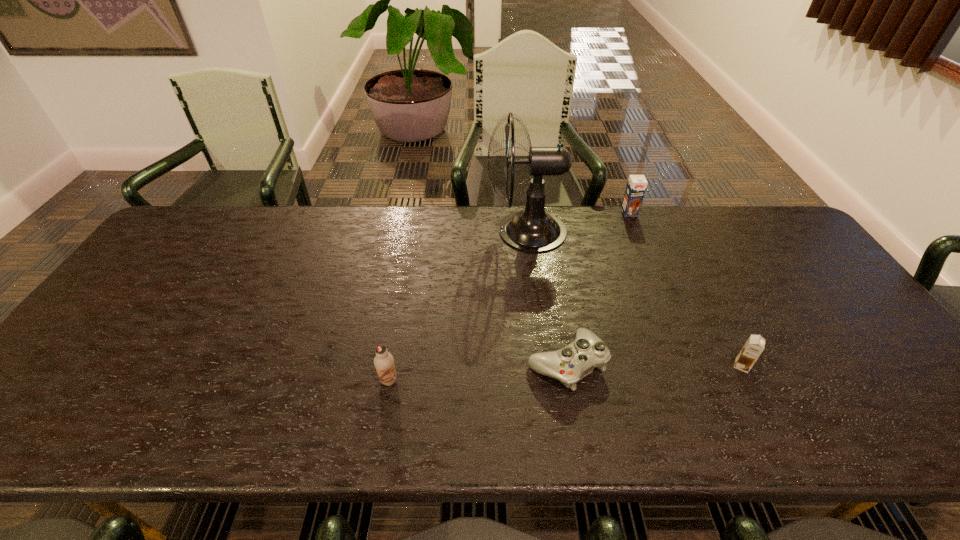
The width and height of the screenshot is (960, 540). What are the coordinates of `the tallest object` in the screenshot? It's located at (533, 230).

Locate an element on the screen. The image size is (960, 540). the fourth object from left to right is located at coordinates (636, 186).

At what (x,y) coordinates should I click in order to perform the action: click on the farthest chocolate milk. Please return your answer as a coordinate pair (x, y). Looking at the image, I should click on (636, 186).

Locate an element on the screen. the leftmost object is located at coordinates [x=384, y=362].

Image resolution: width=960 pixels, height=540 pixels. Find the location of `the second shortest chocolate milk`. the second shortest chocolate milk is located at coordinates (384, 362).

The width and height of the screenshot is (960, 540). Identify the location of the rightmost object. (754, 346).

I want to click on the shortest chocolate milk, so click(754, 346).

Identify the location of the shortest object. The height and width of the screenshot is (540, 960). (570, 364).

You are a GUI agent. You are given a task and a screenshot of the screen. Output one action in this format:
    pyautogui.click(x=<x>, y=<y>)
    Task: Click on the free space located on the front-facing side of the tallest object
    
    Given the screenshot: What is the action you would take?
    pyautogui.click(x=441, y=231)

You are a GUI agent. You are given a task and a screenshot of the screen. Output one action in this format:
    pyautogui.click(x=<x>, y=<y>)
    Task: Click on the free region located on the front-facing side of the tallest object
    This screenshot has width=960, height=540.
    Given the screenshot: What is the action you would take?
    pyautogui.click(x=375, y=231)